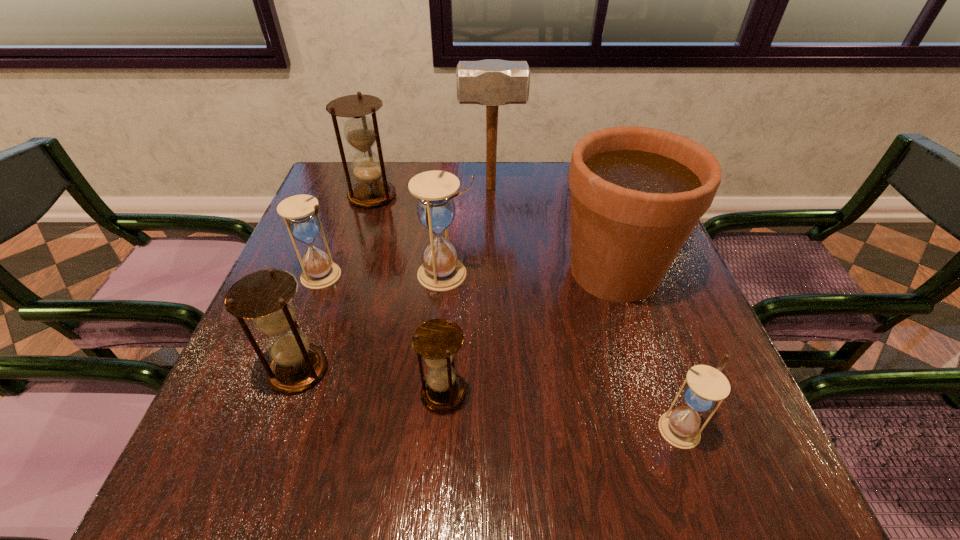
Find the location of a particular element. mallet is located at coordinates (492, 83).

In order to click on flowerpot in this screenshot , I will do `click(637, 193)`.

At what (x,y) coordinates should I click in order to perform the action: click on the second white hourglass from right to left. Please return your answer as a coordinate pair (x, y). Image resolution: width=960 pixels, height=540 pixels. Looking at the image, I should click on (441, 270).

The image size is (960, 540). What are the coordinates of `the biggest brown hourglass` in the screenshot? It's located at (361, 132).

You are a GUI agent. You are given a task and a screenshot of the screen. Output one action in this format:
    pyautogui.click(x=<x>, y=<y>)
    Task: Click on the farthest hourglass
    
    Given the screenshot: What is the action you would take?
    pyautogui.click(x=361, y=132)

Locate an element on the screen. The image size is (960, 540). the second biggest brown hourglass is located at coordinates (265, 296).

At what (x,y) coordinates should I click in order to perform the action: click on the second biggest white hourglass. Please return your answer as a coordinate pair (x, y). Image resolution: width=960 pixels, height=540 pixels. Looking at the image, I should click on (300, 212).

Where is `the rightmost hourglass`? the rightmost hourglass is located at coordinates [x=706, y=386].

Find the location of a particular element. This screenshot has width=960, height=540. the smallest white hourglass is located at coordinates (706, 386).

This screenshot has width=960, height=540. In order to click on the smallest brown hourglass in this screenshot , I will do `click(437, 340)`.